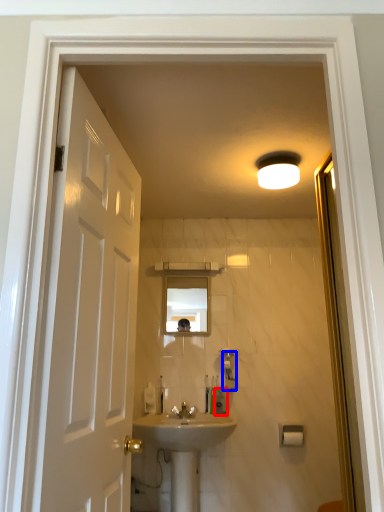
Question: Among these objects, which one is farthest to the camera, toiletry (highlighted by a red box) or soap dispenser (highlighted by a blue box)?

Choices:
 (A) toiletry
 (B) soap dispenser

Answer: (A)